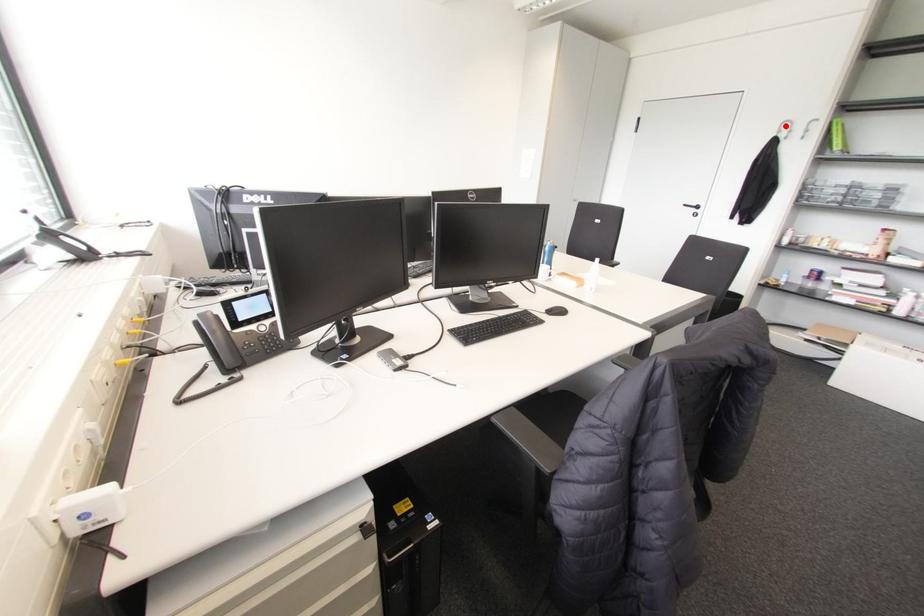
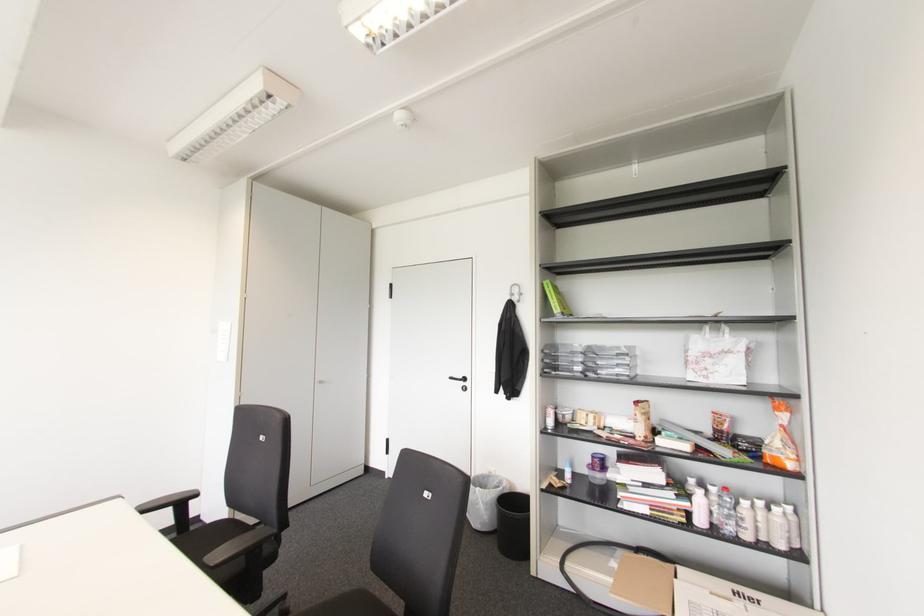
Locate, in the second image, the point that corresponds to the highlighted location in the first image.

(516, 290)